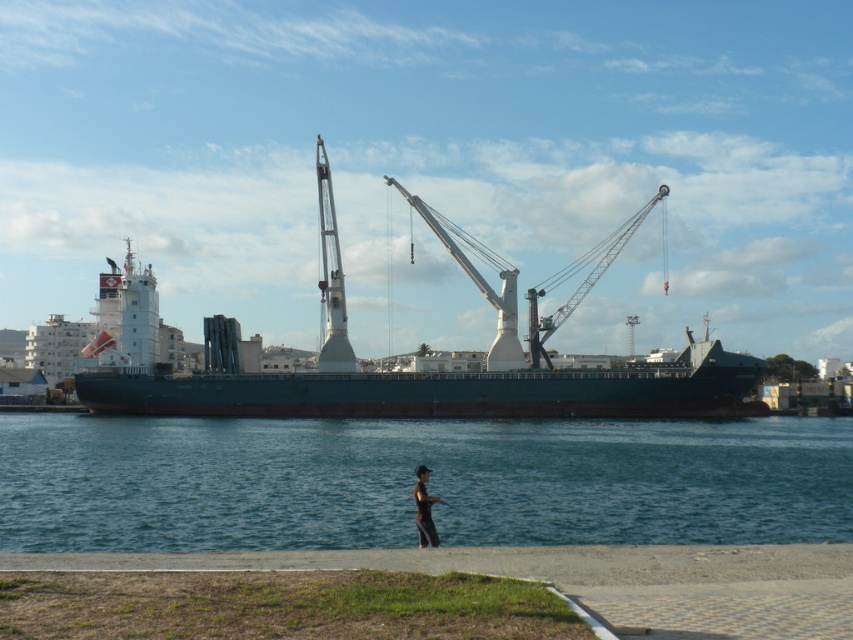
Between clear blue water at center and black fabric person at lower center, which one appears on the left side from the viewer's perspective?

From the viewer's perspective, clear blue water at center appears more on the left side.

Is clear blue water at center above black fabric person at lower center?

No.

Who is more distant from viewer, (317, 528) or (421, 502)?

Positioned behind is point (317, 528).

Locate an element on the screen. The width and height of the screenshot is (853, 640). clear blue water at center is located at coordinates (412, 481).

This screenshot has height=640, width=853. What do you see at coordinates (445, 372) in the screenshot? I see `green matte ship at center` at bounding box center [445, 372].

Can you confirm if green matte ship at center is positioned to the left of metallic gray crane at center?

Yes, green matte ship at center is to the left of metallic gray crane at center.

Between point (461, 410) and point (531, 305), which one is positioned behind?

The point (531, 305) is more distant.

This screenshot has width=853, height=640. In order to click on green matte ship at center in this screenshot , I will do `click(445, 372)`.

Who is taller, clear blue water at center or green matte ship at center?

With more height is green matte ship at center.

Image resolution: width=853 pixels, height=640 pixels. Find the location of `clear blue water at center`. clear blue water at center is located at coordinates (412, 481).